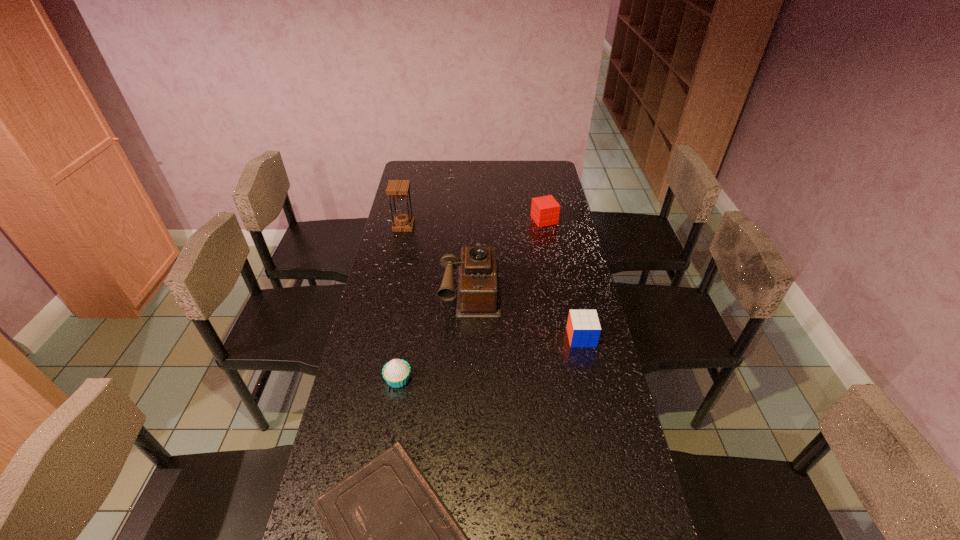
Where is `unoccupied area between the farther cube and the third nearest object`? The height and width of the screenshot is (540, 960). unoccupied area between the farther cube and the third nearest object is located at coordinates (563, 279).

Where is `unoccupied position between the second nearest object and the hourglass`? This screenshot has width=960, height=540. unoccupied position between the second nearest object and the hourglass is located at coordinates (401, 302).

The width and height of the screenshot is (960, 540). What are the coordinates of `vacant space in between the fourth farthest object and the farther cube` in the screenshot? It's located at (563, 279).

Point out which object is positioned as the second nearest to the nearest object. Please provide its 2D coordinates. Your answer should be formatted as a tuple, i.e. [(x, y)], where the tuple contains the x and y coordinates of a point satisfying the conditions above.

[(583, 327)]

Where is `object that is the fifth closest to the hourglass`? This screenshot has height=540, width=960. object that is the fifth closest to the hourglass is located at coordinates (393, 539).

Find the location of a particular element. Image resolution: width=960 pixels, height=540 pixels. vacant point that satisfies the following two spatial constraints: 1. on the front side of the third nearest object; 2. on the left side of the tallest object is located at coordinates (379, 338).

This screenshot has width=960, height=540. What are the coordinates of `vacant space that satisfies the following two spatial constraints: 1. on the front side of the hourglass; 2. on the left side of the third nearest object` in the screenshot? It's located at (379, 338).